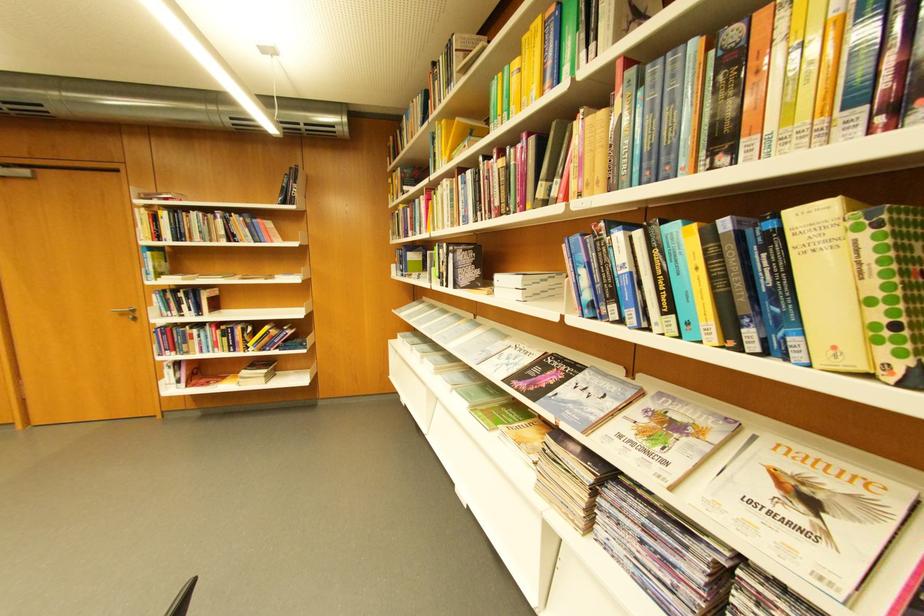
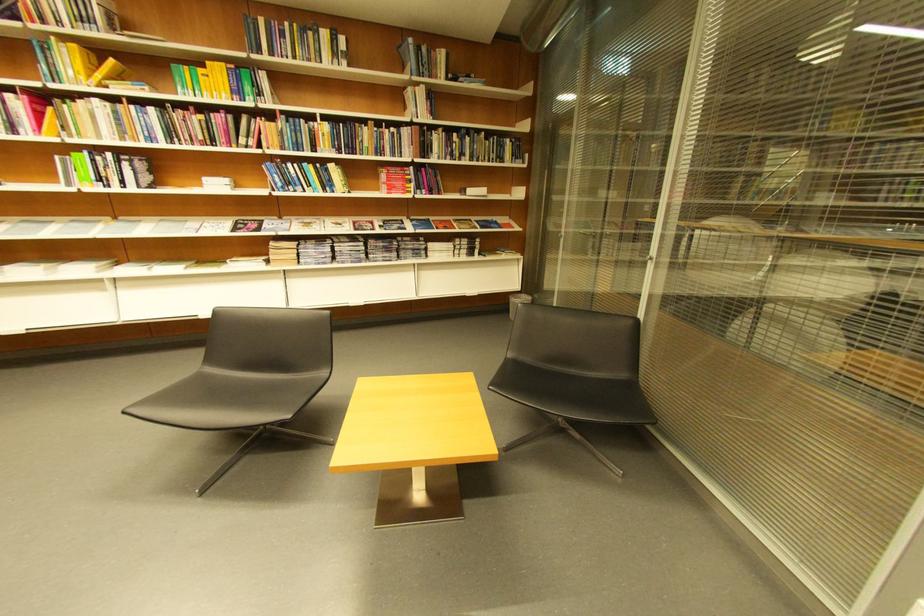
Find the pixel in the second image that matches point 555,204 in the first image.

(258, 148)